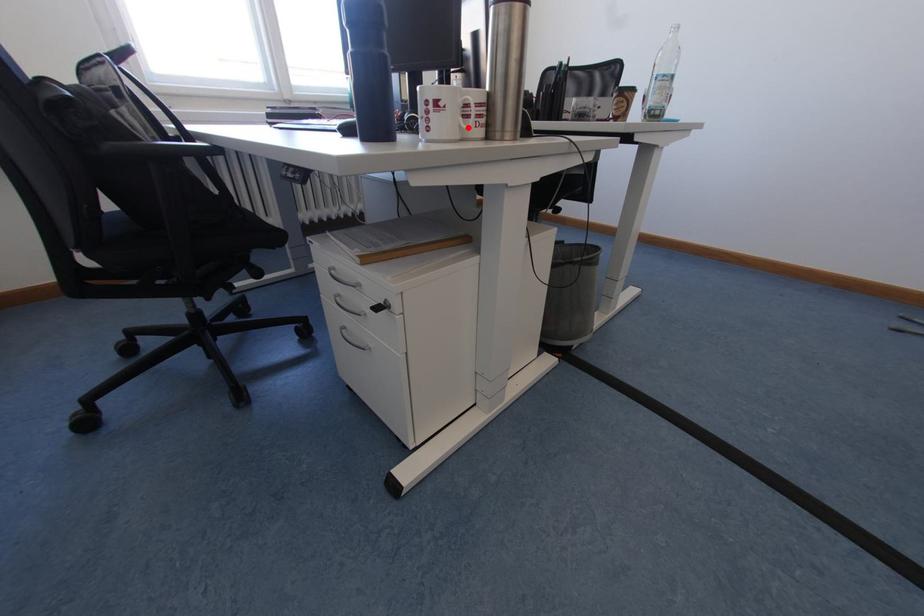
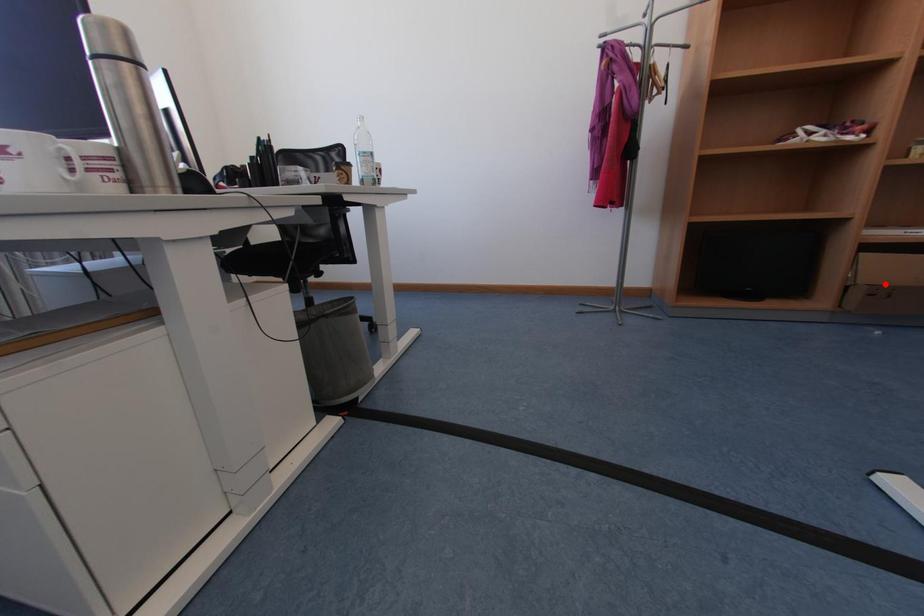
I am providing you with two images of the same scene from different viewpoints. A red point is marked on the first image and another point is marked on the second image. Does the point marked in image1 correspond to the same location as the one in image2?

No